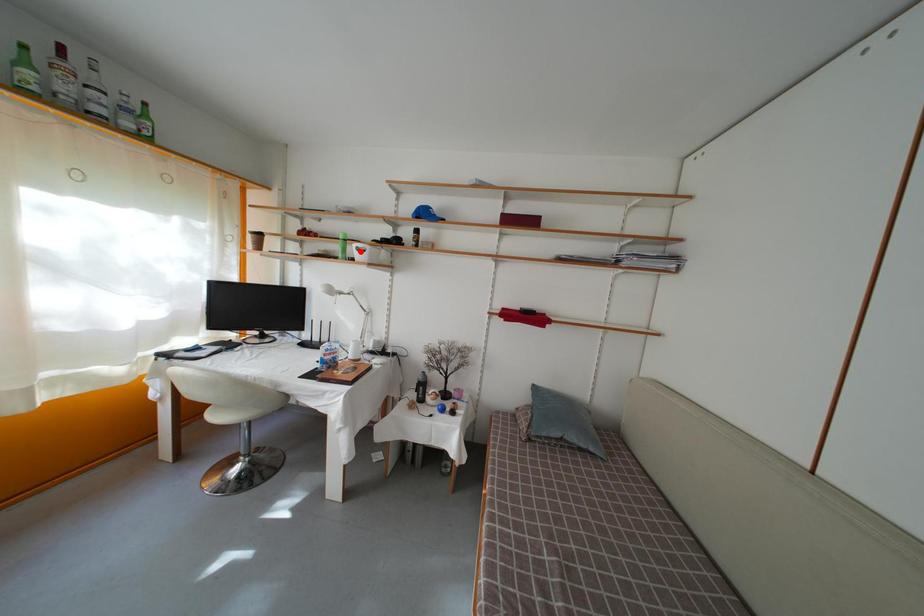
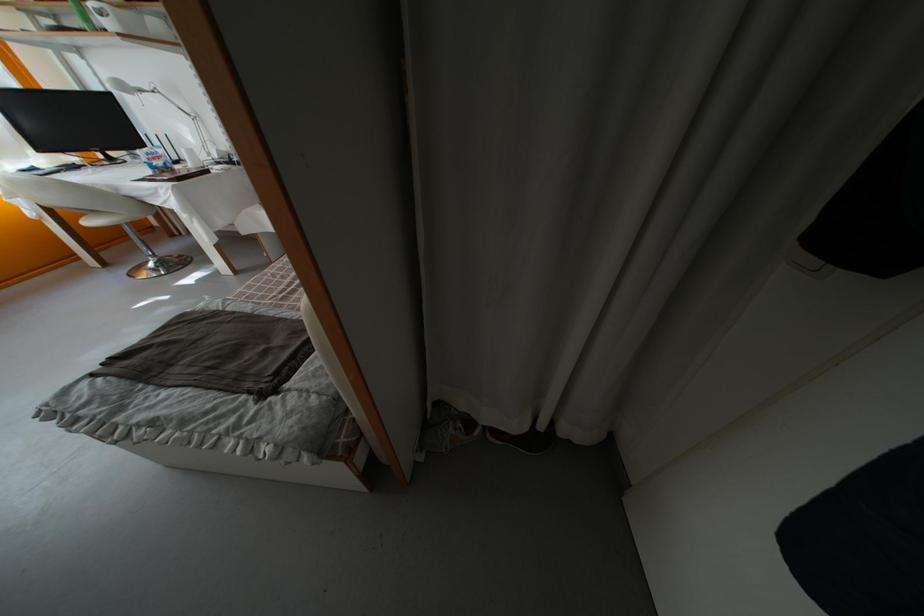
Locate, in the second image, the point that corresponds to the highlighted location in the first image.

(96, 12)